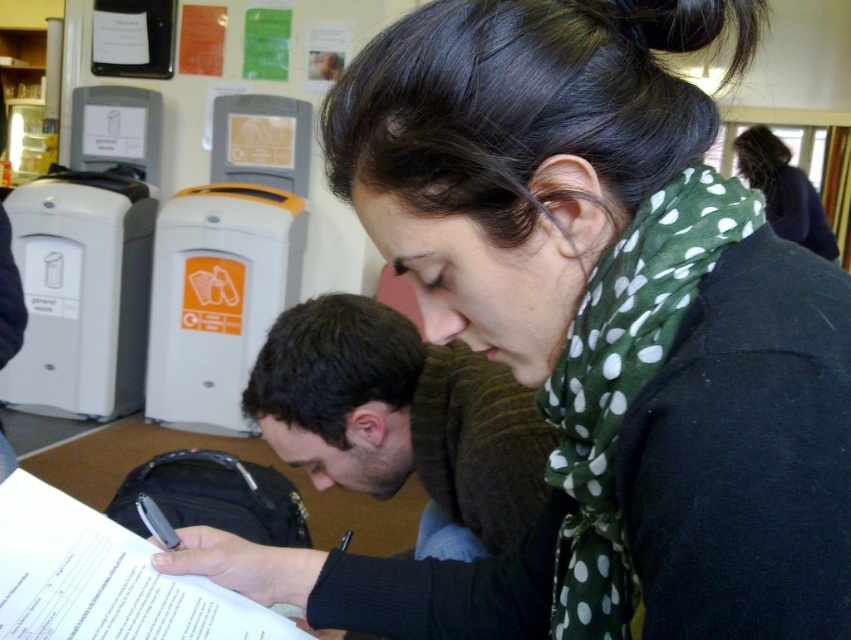
You are a photographer trying to capture a candid shot of both individuals without them noticing. You notice the dark brown hair at center and the white paper at lower left. Which object is closer to the right side of the frame?

The dark brown hair at center is positioned on the right side of white paper at lower left, so it is closer to the right side of the frame.

You are a photographer trying to capture a clear shot of the dark brown hair at center and the green polka dot scarf at upper right. Which object should you focus on first to ensure both are in focus?

The dark brown hair at center is positioned under green polka dot scarf at upper right. Since the dark brown hair is closer to the camera, you should focus on it first to ensure both are in focus.

You are a photographer trying to capture a candid shot of the dark brown hair at center and the white paper at lower left. If you want to ensure both subjects are in focus, which one should you adjust your camera focus on first, considering their sizes?

The dark brown hair at center has a greater width than the white paper at lower left, so you should focus on the dark brown hair at center first as it is larger and might require more precise focus to ensure clarity.